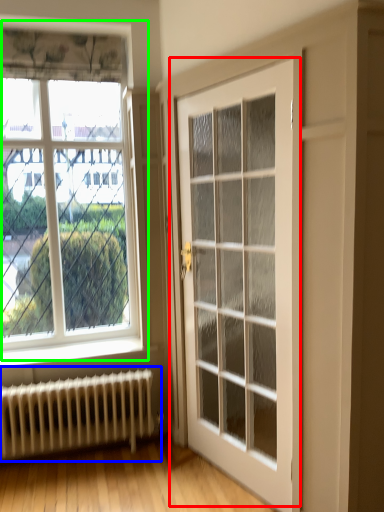
Question: Based on their relative distances, which object is nearer to door (highlighted by a red box)? Choose from radiator (highlighted by a blue box) and window (highlighted by a green box).

Choices:
 (A) radiator
 (B) window

Answer: (B)